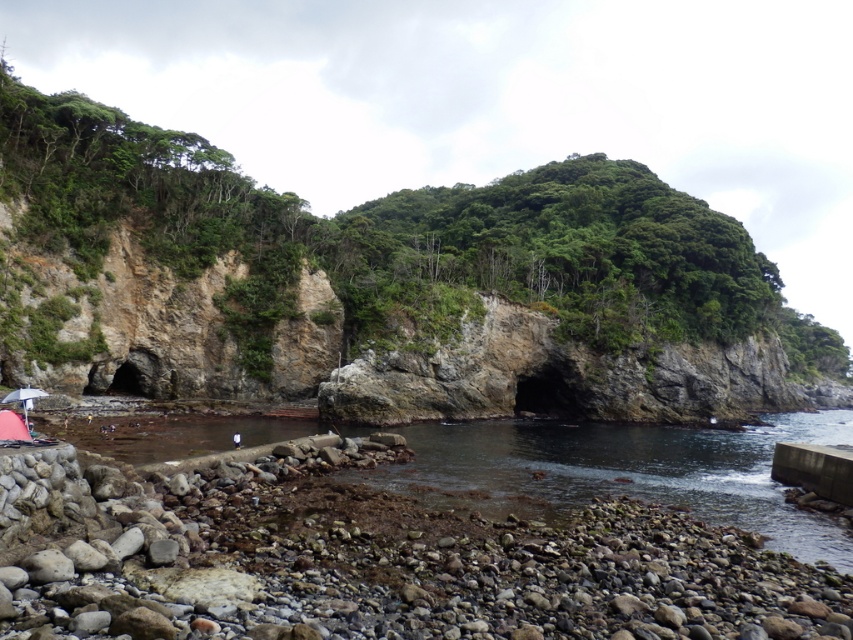
Who is positioned more to the right, rocky cliff at center or transparent plastic umbrella at lower left?

From the viewer's perspective, rocky cliff at center appears more on the right side.

Does rocky cliff at center have a lesser height compared to transparent plastic umbrella at lower left?

No.

Is point (41, 193) less distant than point (45, 392)?

No, (41, 193) is further to viewer.

At what (x,y) coordinates should I click in order to perform the action: click on rocky cliff at center. Please return your answer as a coordinate pair (x, y). This screenshot has width=853, height=640. Looking at the image, I should click on (401, 243).

Is rocky cliff at center smaller than clear water at lower center?

No, rocky cliff at center is not smaller than clear water at lower center.

This screenshot has width=853, height=640. I want to click on rocky cliff at center, so click(x=401, y=243).

Does point (538, 284) come closer to viewer compared to point (334, 476)?

No, it is behind (334, 476).

Identify the location of rocky cliff at center. The width and height of the screenshot is (853, 640). (401, 243).

Who is higher up, clear water at lower center or transparent plastic umbrella at lower left?

transparent plastic umbrella at lower left is above.

Is clear water at lower center bigger than transparent plastic umbrella at lower left?

Correct, clear water at lower center is larger in size than transparent plastic umbrella at lower left.

Identify the location of clear water at lower center. The image size is (853, 640). (619, 472).